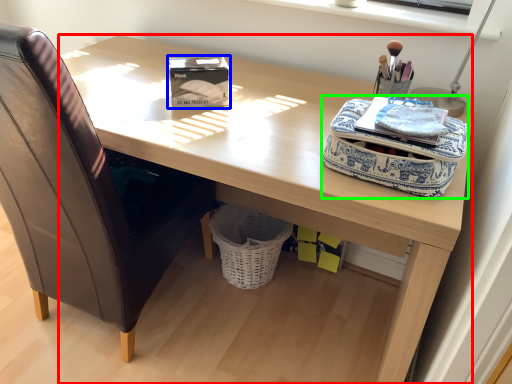
Question: Which object is the closest to the desk (highlighted by a red box)? Choose among these: box (highlighted by a blue box) or bag (highlighted by a green box).

Choices:
 (A) box
 (B) bag

Answer: (A)